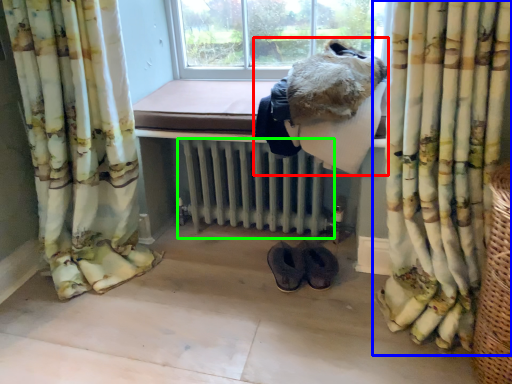
Question: Which object is the farthest from animal (highlighted by a red box)? Choose among these: curtain (highlighted by a blue box) or radiator (highlighted by a green box).

Choices:
 (A) curtain
 (B) radiator

Answer: (B)